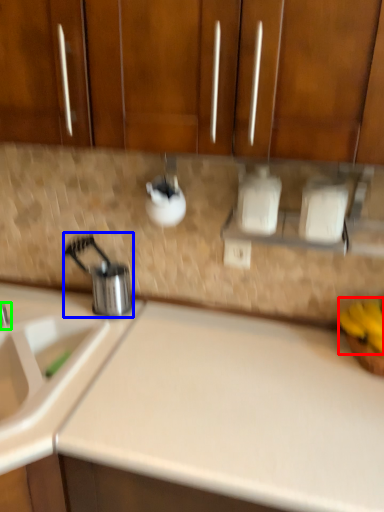
Question: Which object is positioned farthest from banana (highlighted by a red box)? Select from appliance (highlighted by a blue box) and tap (highlighted by a green box).

Choices:
 (A) appliance
 (B) tap

Answer: (B)